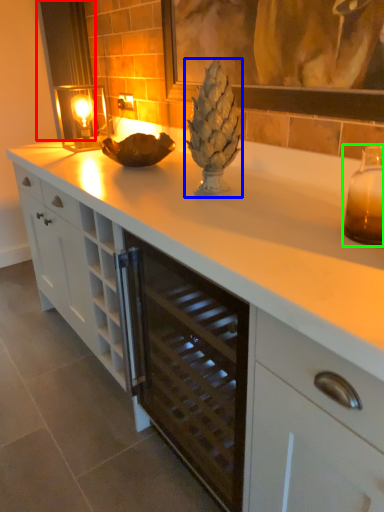
Question: Which is nearer to the curtain (highlighted by a red box)? pineapple (highlighted by a blue box) or candle holder (highlighted by a green box).

Choices:
 (A) pineapple
 (B) candle holder

Answer: (A)